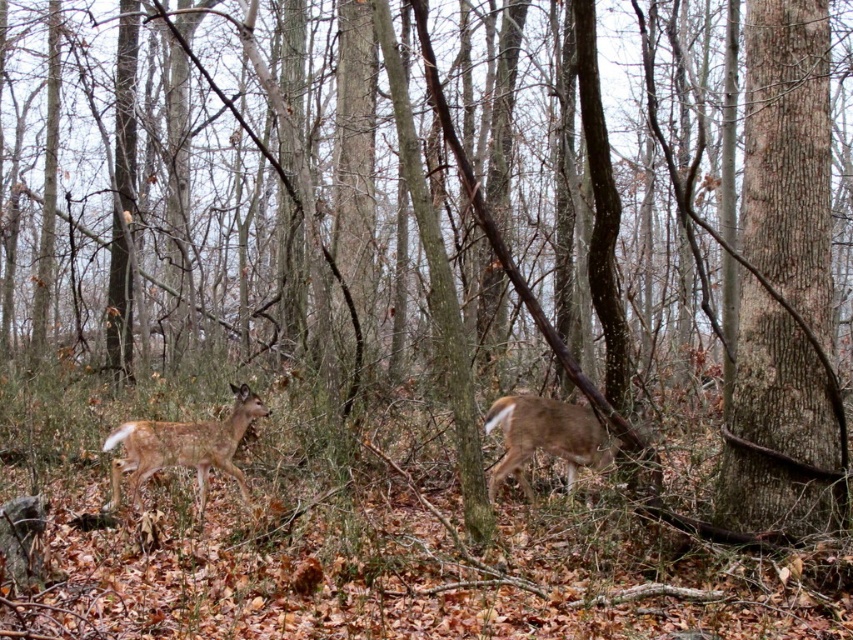
Does point (149, 445) come closer to viewer compared to point (508, 410)?

That is True.

Who is shorter, fawn fur deer at center or brown fur deer at center?

brown fur deer at center

This screenshot has width=853, height=640. Describe the element at coordinates (183, 445) in the screenshot. I see `fawn fur deer at center` at that location.

Locate an element on the screen. This screenshot has height=640, width=853. fawn fur deer at center is located at coordinates (183, 445).

Is point (764, 70) positioned after point (540, 442)?

No, (764, 70) is closer to viewer.

This screenshot has width=853, height=640. Identify the location of smooth brown tree trunk at right. (784, 285).

Where is `smooth brown tree trunk at right`? Image resolution: width=853 pixels, height=640 pixels. smooth brown tree trunk at right is located at coordinates (784, 285).

Who is positioned more to the left, smooth brown tree trunk at right or fawn fur deer at center?

fawn fur deer at center

Image resolution: width=853 pixels, height=640 pixels. What do you see at coordinates (784, 285) in the screenshot?
I see `smooth brown tree trunk at right` at bounding box center [784, 285].

Where is `smooth brown tree trunk at right`? This screenshot has width=853, height=640. smooth brown tree trunk at right is located at coordinates (784, 285).